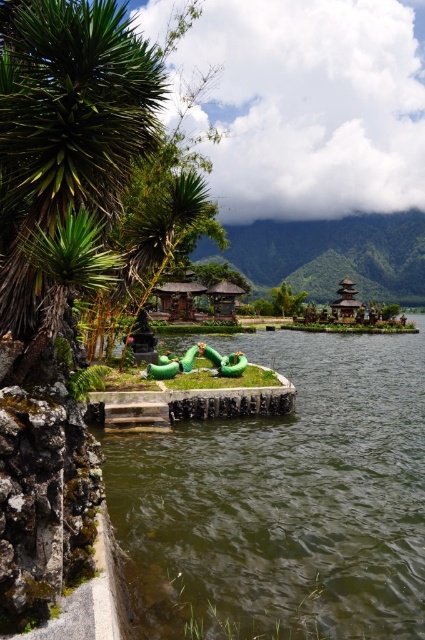
Between green rubber tubes at center and green leafy palm tree at left, which one is positioned higher?

green leafy palm tree at left

Does point (331, 627) lie behind point (68, 60)?

Yes, point (331, 627) is farther from viewer.

Locate an element on the screen. The width and height of the screenshot is (425, 640). green rubber tubes at center is located at coordinates (285, 500).